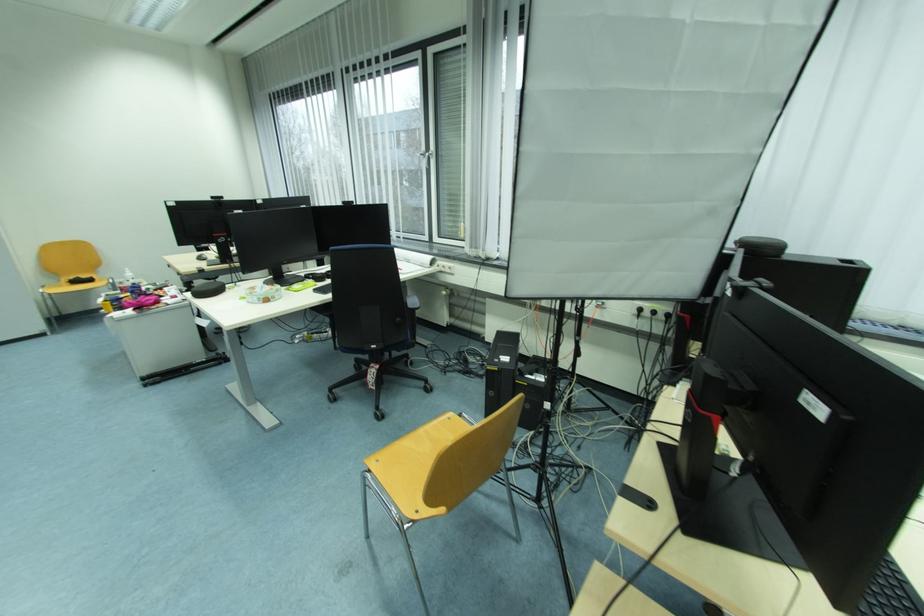
The location [890,593] corresponds to which object?

It corresponds to the black keyboard in the image.